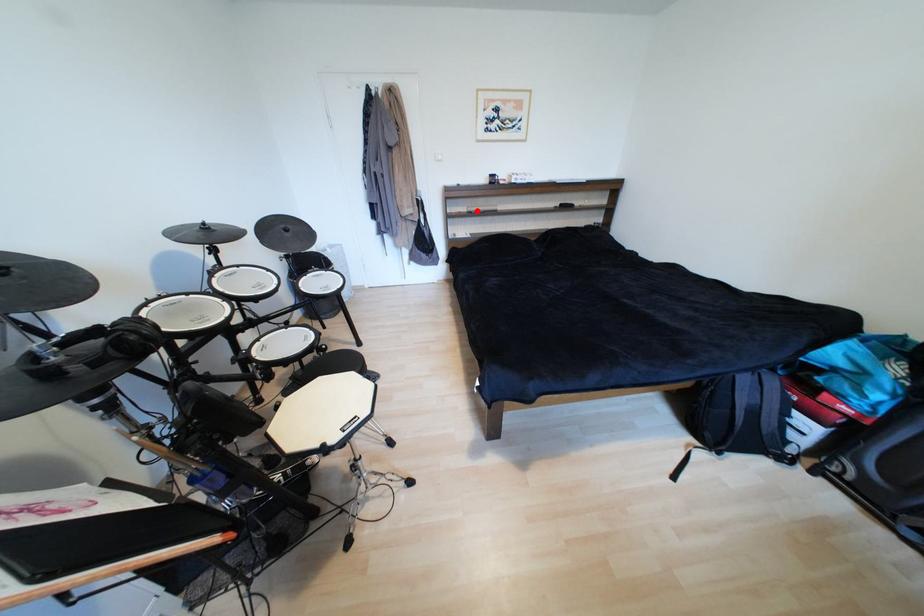
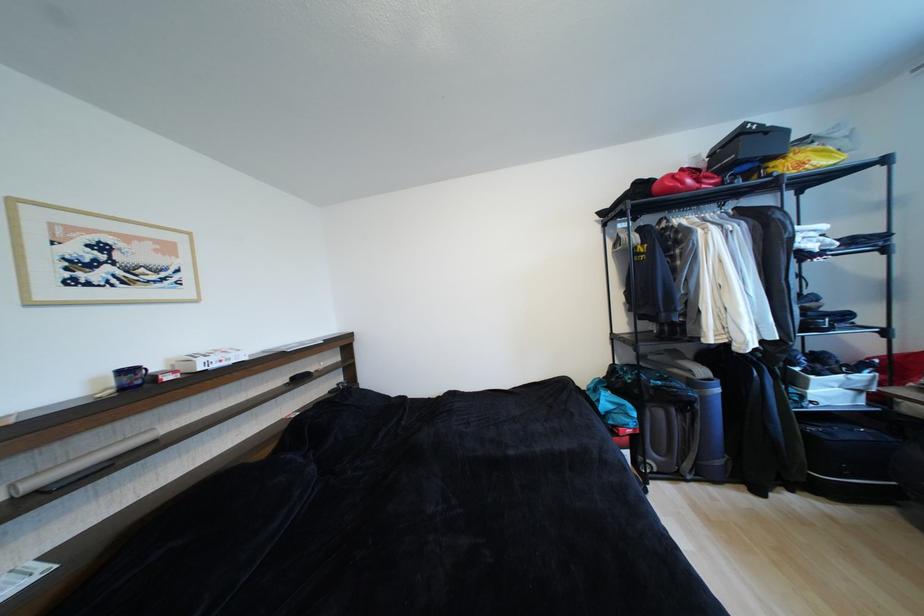
Question: I am providing you with two images of the same scene from different viewpoints. Given a red point in image1, look at the same physical point in image2. Is it:

Choices:
 (A) Closer to the viewpoint
 (B) Farther from the viewpoint

Answer: (B)